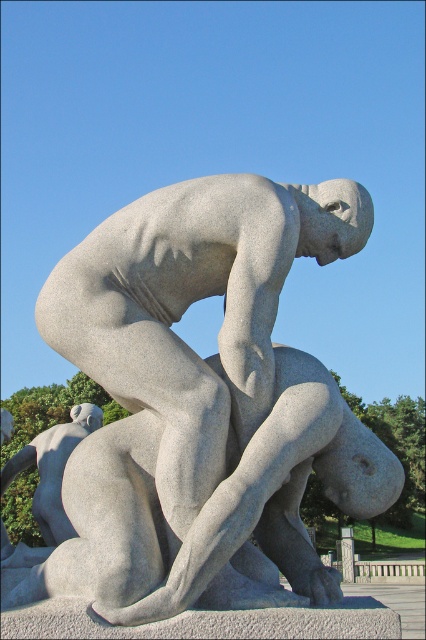
Question: Observing the image, what is the correct spatial positioning of gray stone sculpture at center in reference to gray stone figure at lower left?

Choices:
 (A) below
 (B) above

Answer: (B)

Question: Can you confirm if gray stone sculpture at center is bigger than gray stone figure at lower left?

Choices:
 (A) no
 (B) yes

Answer: (A)

Question: Does gray stone sculpture at center have a lesser width compared to gray stone figure at lower left?

Choices:
 (A) no
 (B) yes

Answer: (B)

Question: Which point is closer to the camera?

Choices:
 (A) gray stone figure at lower left
 (B) gray stone sculpture at center

Answer: (B)